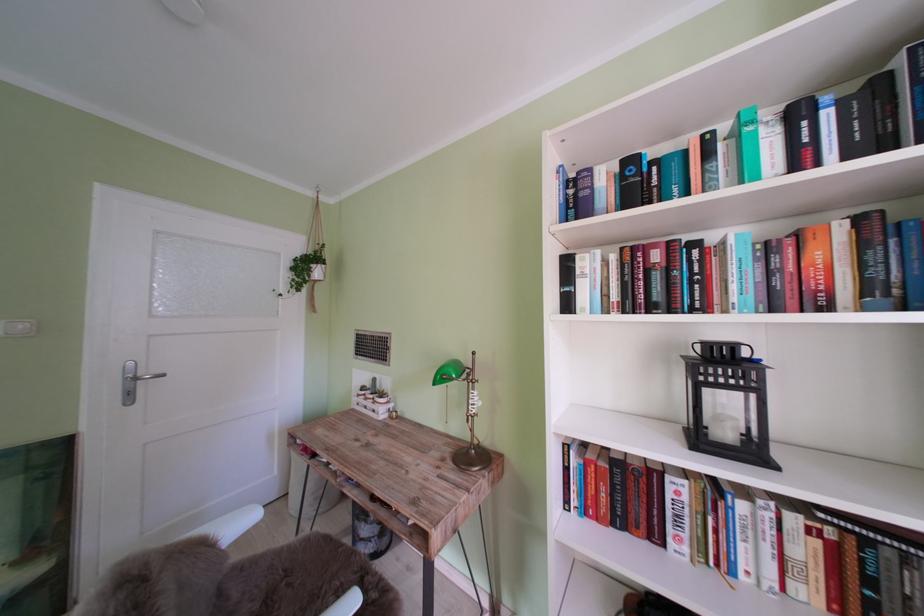
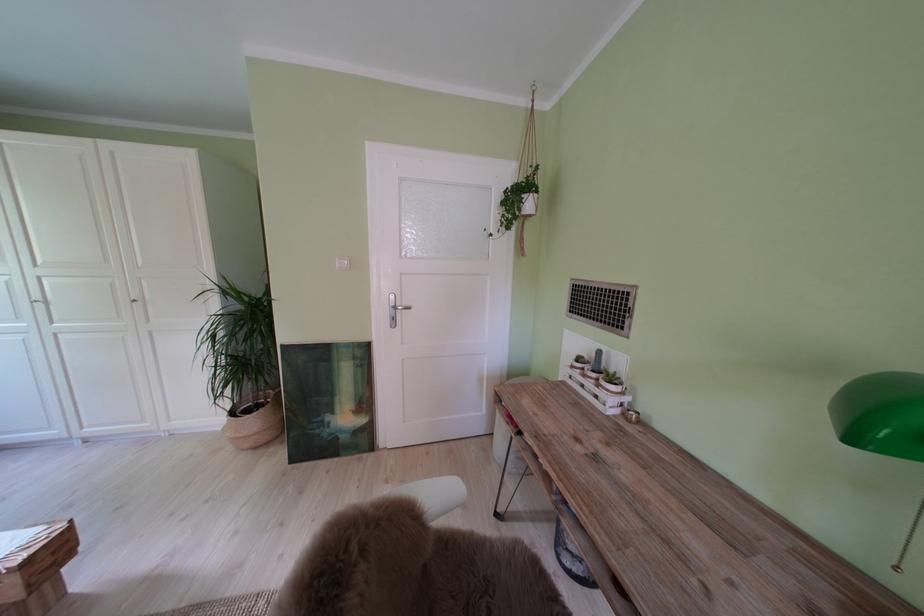
Question: The images are taken continuously from a first-person perspective. In which direction is your viewpoint rotating?

Choices:
 (A) Left
 (B) Right
 (C) Up
 (D) Down

Answer: (A)